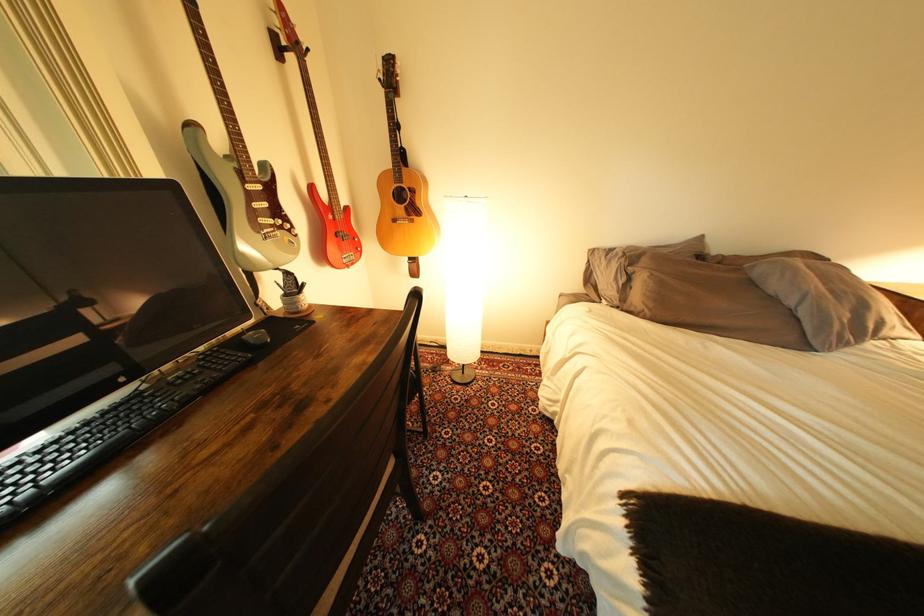
Which object does [238,176] point to?

It refers to a red bass guitar.